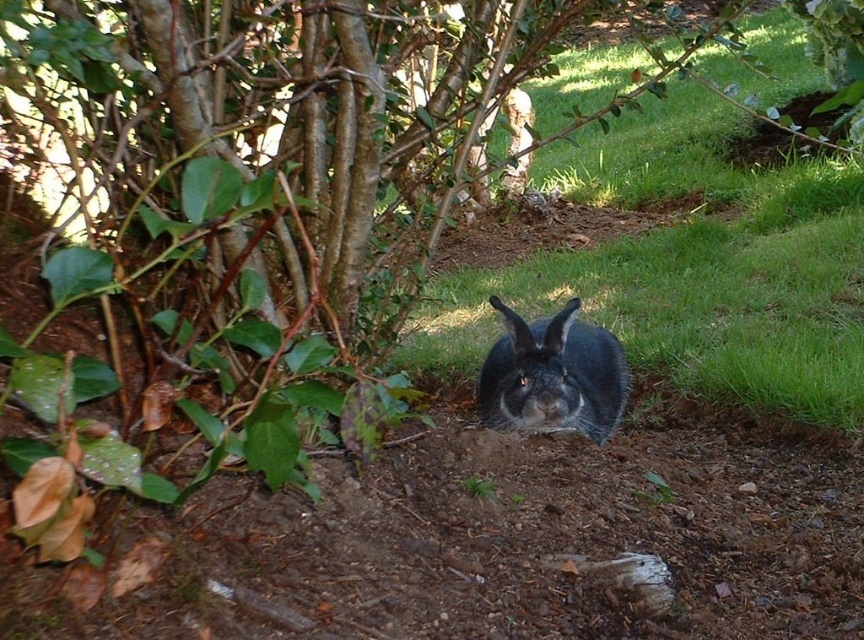
Which is more to the left, green grass at center or fuzzy gray rabbit at center?

Positioned to the left is fuzzy gray rabbit at center.

Between point (850, 269) and point (556, 416), which one is positioned behind?

Point (850, 269)

Does point (469, 326) lie behind point (562, 337)?

Yes, point (469, 326) is behind point (562, 337).

In order to click on green grass at center in this screenshot , I will do `click(691, 268)`.

Is fuzzy gray rabbit at center smaller than brown dirt hole at upper right?

Indeed, fuzzy gray rabbit at center has a smaller size compared to brown dirt hole at upper right.

Between fuzzy gray rabbit at center and brown dirt hole at upper right, which one has more height?

brown dirt hole at upper right is taller.

Locate an element on the screen. This screenshot has width=864, height=640. fuzzy gray rabbit at center is located at coordinates (553, 376).

Where is `fuzzy gray rabbit at center`? This screenshot has height=640, width=864. fuzzy gray rabbit at center is located at coordinates point(553,376).

Who is more forward, [773,209] or [729,147]?

Positioned in front is point [773,209].

Is green grass at center behind brown dirt hole at upper right?

No, it is not.

Which is in front, point (773, 33) or point (814, 118)?

Point (814, 118) is in front.

I want to click on green grass at center, so click(x=691, y=268).